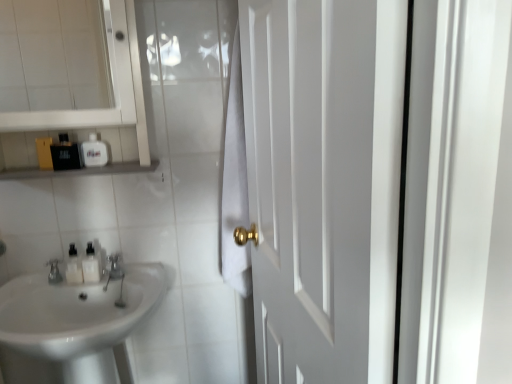
Question: Are white glossy bottles at left, which is counted as the third toiletry, starting from the top, and matte black bottle at upper left, the 3th toiletry ordered from the bottom, located far from each other?

Choices:
 (A) no
 (B) yes

Answer: (A)

Question: Does white glossy bottles at left, which is the 1th toiletry from bottom to top, have a greater height compared to matte black bottle at upper left, the 3th toiletry ordered from the bottom?

Choices:
 (A) yes
 (B) no

Answer: (B)

Question: Is white glossy bottles at left, which is counted as the third toiletry, starting from the top, oriented towards matte black bottle at upper left, the 3th toiletry ordered from the bottom?

Choices:
 (A) yes
 (B) no

Answer: (B)

Question: From a real-world perspective, is white glossy bottles at left, which is counted as the third toiletry, starting from the top, positioned over matte black bottle at upper left, the 3th toiletry ordered from the bottom, based on gravity?

Choices:
 (A) yes
 (B) no

Answer: (B)

Question: Is white glossy bottles at left, which is the 1th toiletry from bottom to top, thinner than matte black bottle at upper left, which appears as the 1th toiletry when viewed from the top?

Choices:
 (A) no
 (B) yes

Answer: (A)

Question: In terms of width, does white glossy medicine cabinet at upper left look wider or thinner when compared to white matte door at right?

Choices:
 (A) thin
 (B) wide

Answer: (B)

Question: From a real-world perspective, is white glossy medicine cabinet at upper left above or below white matte door at right?

Choices:
 (A) below
 (B) above

Answer: (B)

Question: Is point click(34, 115) closer or farther from the camera than point click(332, 160)?

Choices:
 (A) farther
 (B) closer

Answer: (A)

Question: From the image's perspective, is white glossy medicine cabinet at upper left located above or below white matte door at right?

Choices:
 (A) above
 (B) below

Answer: (A)

Question: Relative to white glossy medicine cabinet at upper left, is white glossy soap dispenser at upper left in front or behind?

Choices:
 (A) behind
 (B) front

Answer: (A)

Question: Is point (98, 150) positioned closer to the camera than point (133, 86)?

Choices:
 (A) farther
 (B) closer

Answer: (A)

Question: From the image's perspective, is white glossy soap dispenser at upper left located above or below white glossy medicine cabinet at upper left?

Choices:
 (A) above
 (B) below

Answer: (B)

Question: Based on their sizes in the image, would you say white glossy soap dispenser at upper left is bigger or smaller than white glossy medicine cabinet at upper left?

Choices:
 (A) small
 (B) big

Answer: (A)

Question: Considering the positions of matte black bottle at upper left, which appears as the 1th toiletry when viewed from the top, and brushed metal faucet at lower left in the image, is matte black bottle at upper left, which appears as the 1th toiletry when viewed from the top, wider or thinner than brushed metal faucet at lower left?

Choices:
 (A) thin
 (B) wide

Answer: (A)

Question: Would you say matte black bottle at upper left, which appears as the 1th toiletry when viewed from the top, is to the left or to the right of brushed metal faucet at lower left in the picture?

Choices:
 (A) right
 (B) left

Answer: (B)